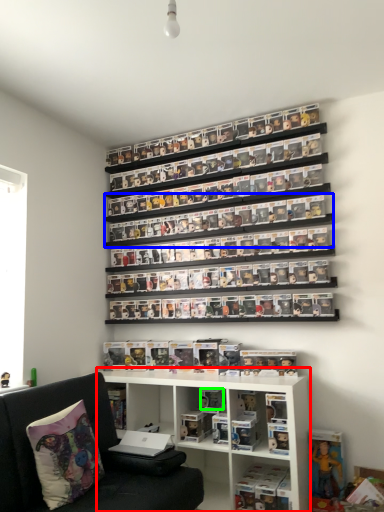
Question: Based on their relative distances, which object is nearer to shelf (highlighted by a red box)? Choose from shelf (highlighted by a blue box) and toy (highlighted by a green box).

Choices:
 (A) shelf
 (B) toy

Answer: (B)